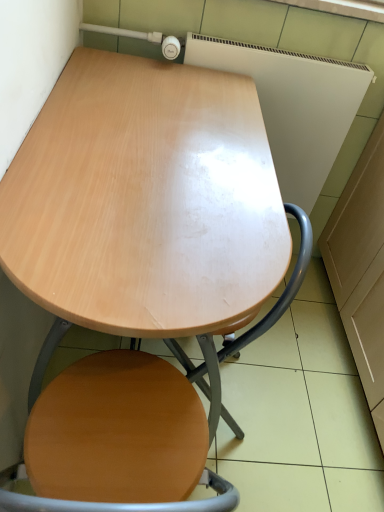
Question: From a real-world perspective, is light wood table at center on top of wooden swivel chair at center?

Choices:
 (A) yes
 (B) no

Answer: (A)

Question: Is light wood table at center with wooden swivel chair at center?

Choices:
 (A) yes
 (B) no

Answer: (B)

Question: Would you consider light wood table at center to be distant from wooden swivel chair at center?

Choices:
 (A) no
 (B) yes

Answer: (A)

Question: From the image's perspective, is light wood table at center located above wooden swivel chair at center?

Choices:
 (A) yes
 (B) no

Answer: (A)

Question: Could you tell me if light wood table at center is facing wooden swivel chair at center?

Choices:
 (A) no
 (B) yes

Answer: (B)

Question: Does light wood table at center appear on the right side of wooden swivel chair at center?

Choices:
 (A) yes
 (B) no

Answer: (B)

Question: Can you confirm if wooden swivel chair at center is positioned to the right of light wood table at center?

Choices:
 (A) no
 (B) yes

Answer: (B)

Question: From a real-world perspective, is wooden swivel chair at center physically below light wood table at center?

Choices:
 (A) no
 (B) yes

Answer: (B)

Question: From the image's perspective, is wooden swivel chair at center below light wood table at center?

Choices:
 (A) no
 (B) yes

Answer: (B)

Question: Is wooden swivel chair at center smaller than light wood table at center?

Choices:
 (A) yes
 (B) no

Answer: (A)

Question: Is wooden swivel chair at center taller than light wood table at center?

Choices:
 (A) no
 (B) yes

Answer: (A)

Question: Considering the relative sizes of wooden swivel chair at center and light wood table at center in the image provided, is wooden swivel chair at center bigger than light wood table at center?

Choices:
 (A) yes
 (B) no

Answer: (B)

Question: In terms of height, does light wood table at center look taller or shorter compared to wooden swivel chair at center?

Choices:
 (A) short
 (B) tall

Answer: (B)